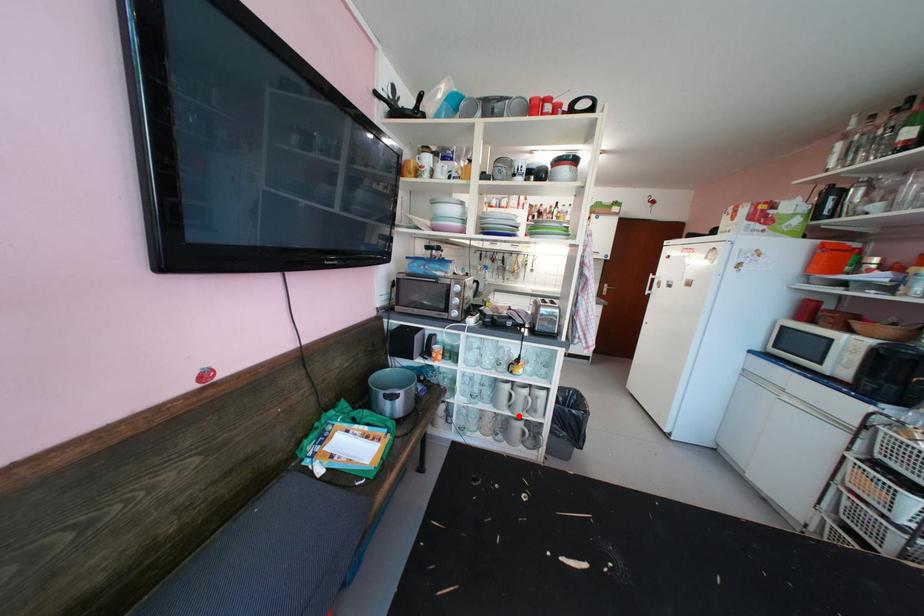
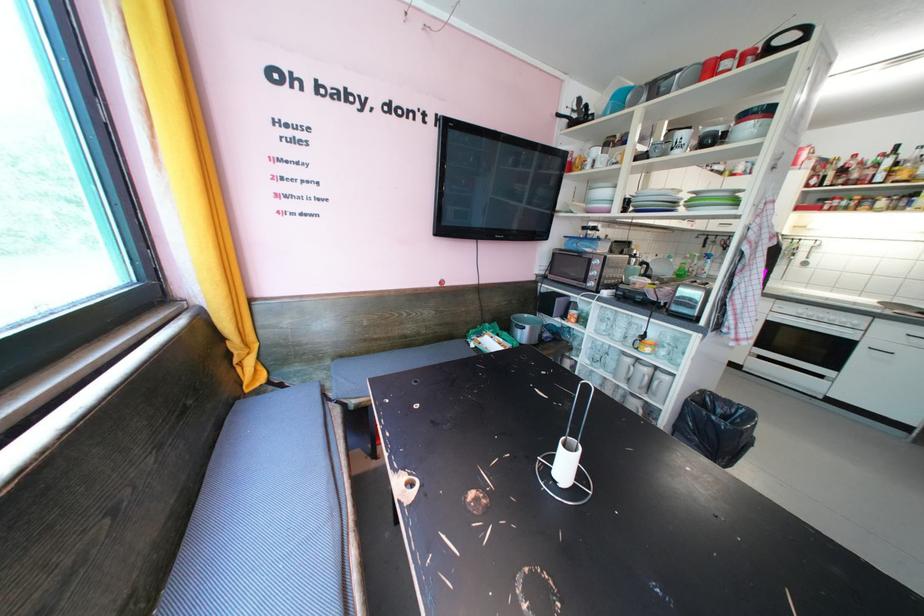
Question: I am providing you with two images of the same scene from different viewpoints. Image1 has a red point marked. In image2, the corresponding 3D location appears at what relative position? Reply with the corresponding letter.

Choices:
 (A) Closer
 (B) Farther

Answer: (A)